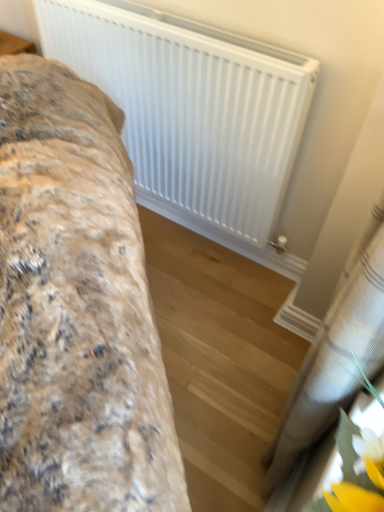
Question: Can we say white matte radiator at upper center lies outside fluffy fabric bed at left?

Choices:
 (A) no
 (B) yes

Answer: (B)

Question: Is white matte radiator at upper center turned away from fluffy fabric bed at left?

Choices:
 (A) yes
 (B) no

Answer: (B)

Question: Does white matte radiator at upper center appear on the right side of fluffy fabric bed at left?

Choices:
 (A) yes
 (B) no

Answer: (A)

Question: Can you confirm if white matte radiator at upper center is shorter than fluffy fabric bed at left?

Choices:
 (A) yes
 (B) no

Answer: (A)

Question: Is white matte radiator at upper center not near fluffy fabric bed at left?

Choices:
 (A) no
 (B) yes

Answer: (A)

Question: Does white matte radiator at upper center have a smaller size compared to fluffy fabric bed at left?

Choices:
 (A) no
 (B) yes

Answer: (B)

Question: Is white sheer curtain at lower right completely or partially inside fluffy fabric bed at left?

Choices:
 (A) no
 (B) yes

Answer: (A)

Question: From the image's perspective, is fluffy fabric bed at left over white sheer curtain at lower right?

Choices:
 (A) yes
 (B) no

Answer: (A)

Question: Could you tell me if fluffy fabric bed at left is facing white sheer curtain at lower right?

Choices:
 (A) no
 (B) yes

Answer: (A)

Question: Is fluffy fabric bed at left oriented away from white sheer curtain at lower right?

Choices:
 (A) yes
 (B) no

Answer: (A)

Question: Is fluffy fabric bed at left far away from white sheer curtain at lower right?

Choices:
 (A) no
 (B) yes

Answer: (A)

Question: Can you confirm if fluffy fabric bed at left is smaller than white sheer curtain at lower right?

Choices:
 (A) no
 (B) yes

Answer: (A)

Question: Does fluffy fabric bed at left have a larger size compared to white matte radiator at upper center?

Choices:
 (A) no
 (B) yes

Answer: (B)